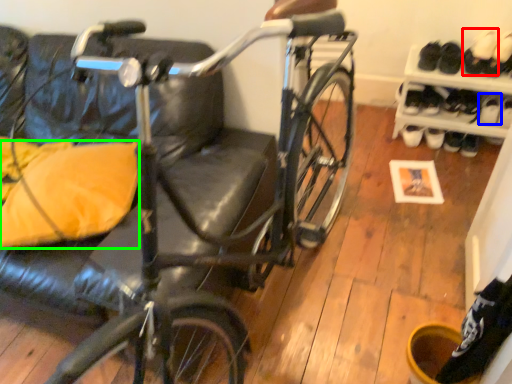
Question: Which is farther away from footwear (highlighted by a red box)? shoe (highlighted by a blue box) or pillow (highlighted by a green box)?

Choices:
 (A) shoe
 (B) pillow

Answer: (B)